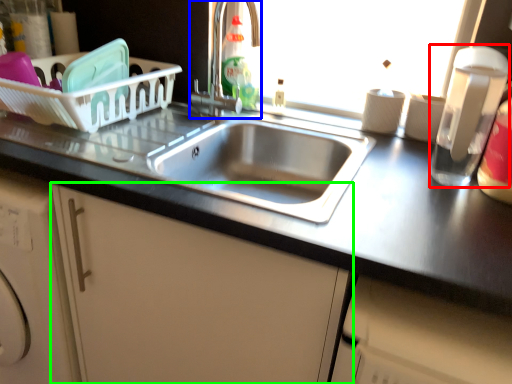
Question: Considering the real-world distances, which object is farthest from appliance (highlighted by a red box)? tap (highlighted by a blue box) or cabinetry (highlighted by a green box)?

Choices:
 (A) tap
 (B) cabinetry

Answer: (A)